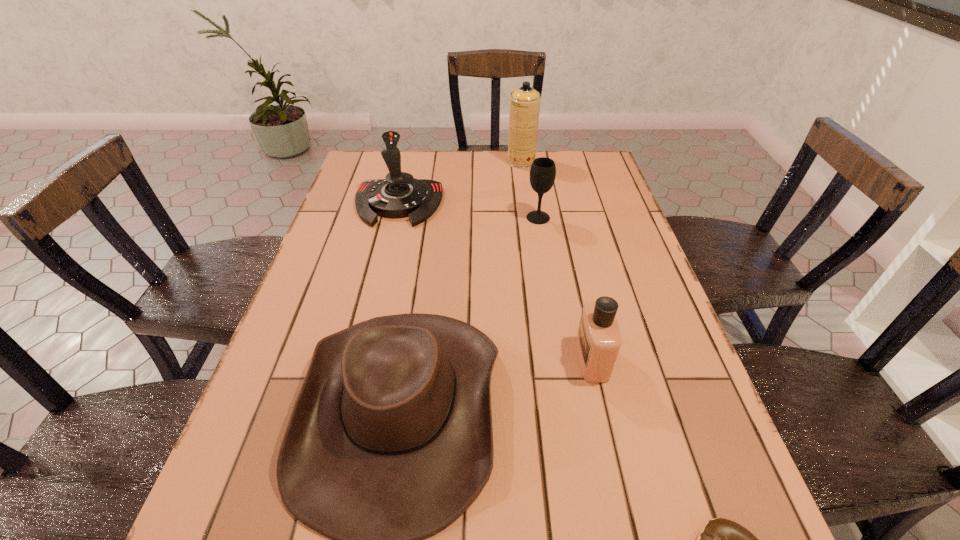
Where is `free point between the tallest object and the perfume`? free point between the tallest object and the perfume is located at coordinates (557, 260).

Find the location of `vacant area between the second tallest object and the wineglass`. vacant area between the second tallest object and the wineglass is located at coordinates (468, 211).

The image size is (960, 540). In order to click on unoccupied position between the second tallest object and the wineglass in this screenshot , I will do `click(468, 211)`.

Locate an element on the screen. free space between the perfume and the joystick is located at coordinates (495, 281).

At what (x,y) coordinates should I click in order to perform the action: click on vacant region between the tallest object and the perfume. Please return your answer as a coordinate pair (x, y). Looking at the image, I should click on (557, 260).

The image size is (960, 540). In order to click on free spot between the tallest object and the wineglass in this screenshot , I will do `click(530, 190)`.

This screenshot has width=960, height=540. Find the location of `unoccupied position between the tallest object and the wineglass`. unoccupied position between the tallest object and the wineglass is located at coordinates (530, 190).

The image size is (960, 540). In order to click on free spot between the aerosol can and the wineglass in this screenshot , I will do `click(530, 190)`.

Select which object is the fourth closest to the joystick. Please provide its 2D coordinates. Your answer should be formatted as a tuple, i.e. [(x, y)], where the tuple contains the x and y coordinates of a point satisfying the conditions above.

[(598, 341)]

Where is `the closest object to the perfume`? The image size is (960, 540). the closest object to the perfume is located at coordinates 390,440.